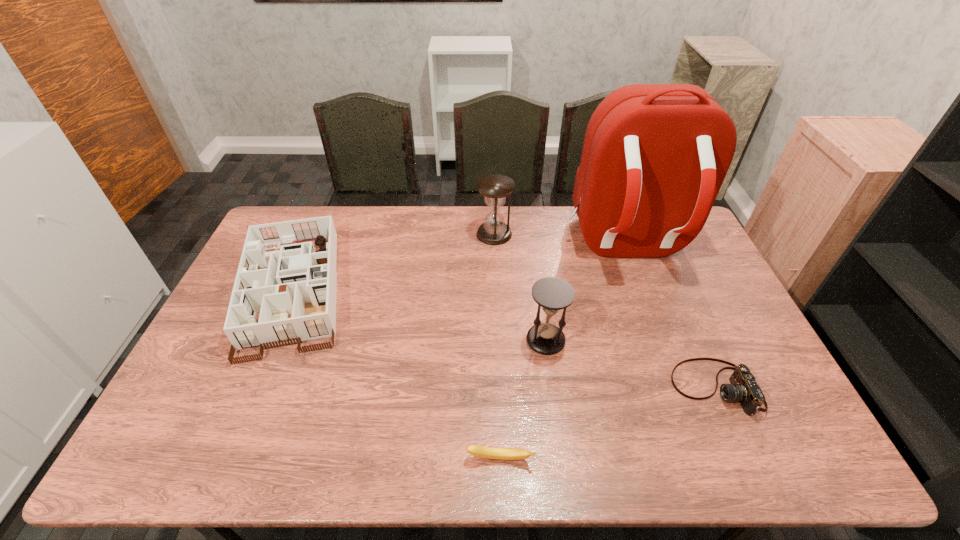
Image resolution: width=960 pixels, height=540 pixels. Identify the location of vacant space situated on the back of the right hourglass. (536, 268).

Where is `vacant region located 0.160m on the back of the dollhouse`? vacant region located 0.160m on the back of the dollhouse is located at coordinates (327, 210).

Identify the location of vacant space located on the front-facing side of the camera. (x=538, y=388).

Where is `free location located 0.280m on the front-facing side of the camera`? This screenshot has width=960, height=540. free location located 0.280m on the front-facing side of the camera is located at coordinates (567, 388).

I want to click on vacant space situated on the front-facing side of the camera, so click(632, 388).

What are the coordinates of `backpack positioned at the far edge` in the screenshot? It's located at (654, 158).

Locate an element on the screen. This screenshot has width=960, height=540. hourglass that is at the far edge is located at coordinates (495, 188).

Where is `dollhouse situated at the far edge`? dollhouse situated at the far edge is located at coordinates [x=294, y=289].

You are a GUI agent. You are given a task and a screenshot of the screen. Output one action in this format:
    pyautogui.click(x=<x>, y=<y>)
    Task: Click on the object positioned at the near edge
    This screenshot has height=540, width=960.
    Given the screenshot: What is the action you would take?
    pyautogui.click(x=479, y=451)

At what (x,y) coordinates should I click in order to perform the action: click on object at the left edge. Please return your answer as a coordinate pair (x, y). Looking at the image, I should click on (294, 289).